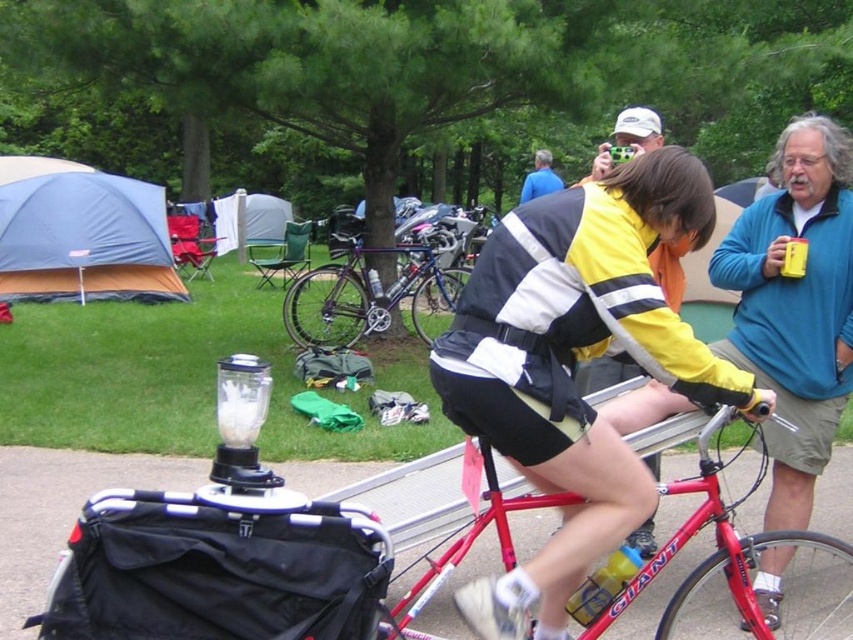
You are standing at the campsite and want to walk from the point marked at coordinates point (798, 513) to the point marked at coordinates point (38, 189). According to the scene, which direction should you head?

You should head towards the direction from point (798, 513) to point (38, 189), which is diagonally downward and to the left since point (38, 189) is behind point (798, 513).

From the picture: You are a photographer standing at the center of the campsite. You want to take a photo of the blue fleece jacket at upper right. Which direction should you move to get the jacket in the frame?

The blue fleece jacket at upper right is located at point 0.477 on the x axis and 0.933 on the y axis. Since you are at the center, you should move towards the upper right direction to get the jacket in the frame.

You are organizing a cycling event and need to decide which clothing item to place in a small storage box. The box can only fit items that take up minimal space. Based on the scene, which item between the yellow matte jacket at center and the blue fabric shirt at upper center should you choose?

The yellow matte jacket at center occupies less space than the blue fabric shirt at upper center, so it should be chosen for the small storage box.